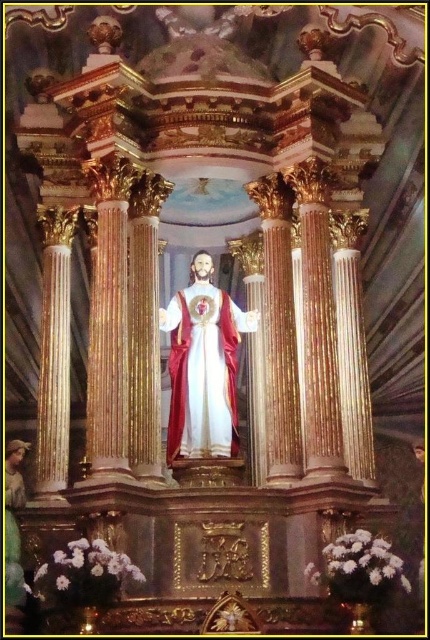
Question: Among these points, which one is farthest from the camera?

Choices:
 (A) (180, 310)
 (B) (14, 460)

Answer: (A)

Question: Can you confirm if white satin statue at center is positioned to the right of wooden statue at lower left?

Choices:
 (A) no
 (B) yes

Answer: (B)

Question: Does white satin statue at center have a smaller size compared to wooden statue at lower left?

Choices:
 (A) yes
 (B) no

Answer: (B)

Question: Among these points, which one is farthest from the camera?

Choices:
 (A) (9, 468)
 (B) (194, 314)

Answer: (B)

Question: Where is white satin statue at center located in relation to wooden statue at lower left in the image?

Choices:
 (A) above
 (B) below

Answer: (A)